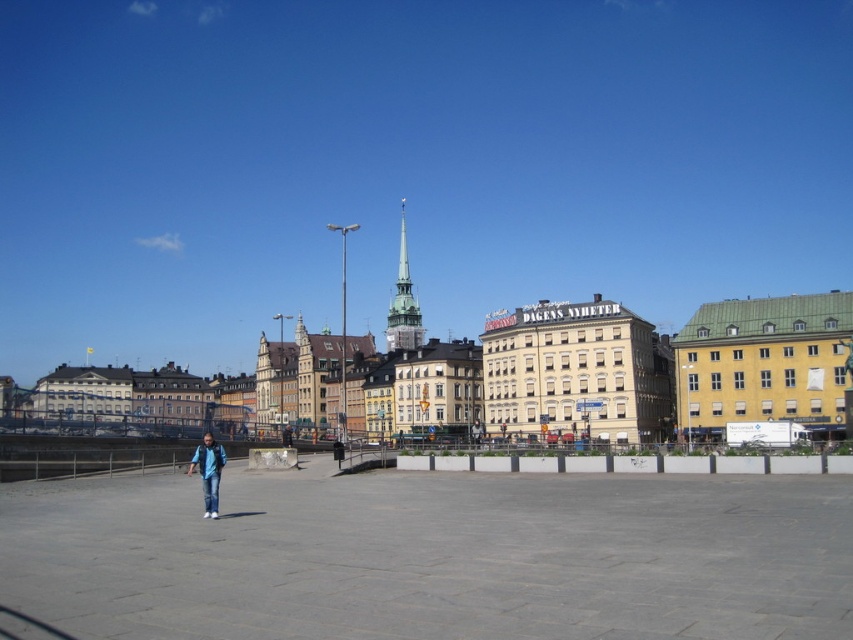
You are a photographer standing in the plaza and want to capture a photo that includes both the gold textured spire at center and the blue jeans at center. Which object should you adjust your camera angle to focus on first to ensure both are in the frame?

The gold textured spire at center is above the blue jeans at center, so you should focus on the gold textured spire at center first to ensure both are in the frame.

You are a city planner assessing the plaza layout. The gold textured spire at center and the blue jeans at center are both in the plaza. Which object takes up more horizontal space in the image?

The gold textured spire at center takes up more horizontal space than the blue jeans at center because its width is larger according to the description.